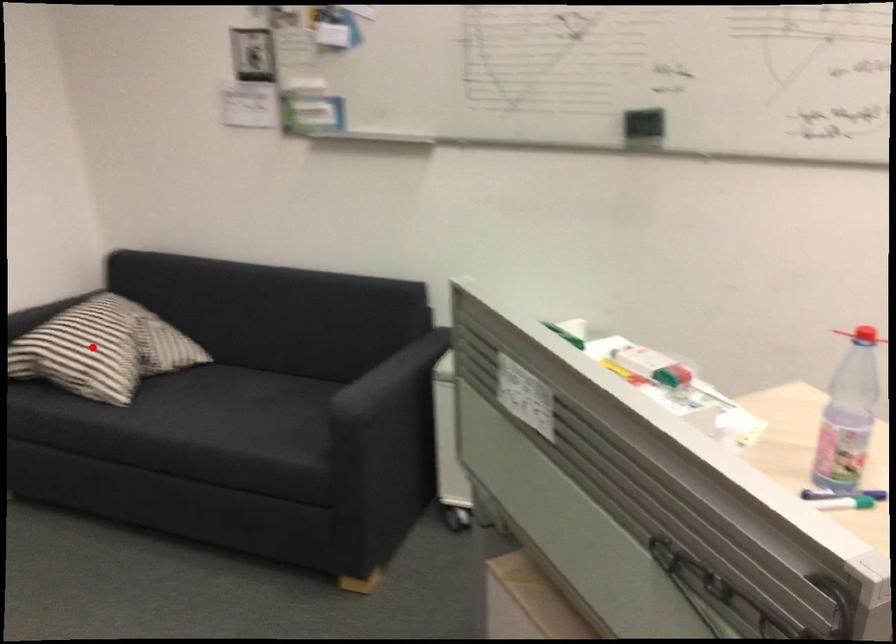
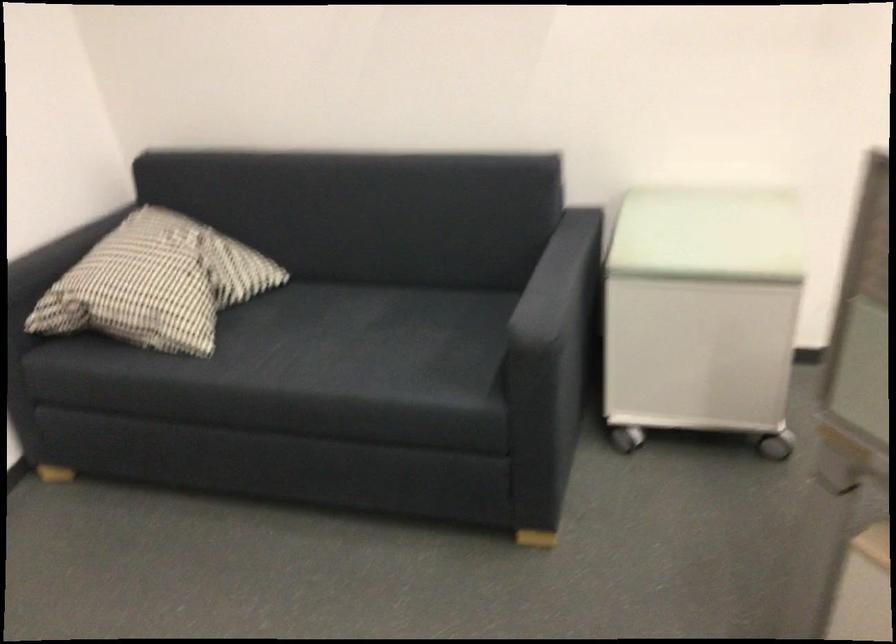
Question: I am providing you with two images of the same scene from different viewpoints. A red point is shown in image1. For the corresponding object point in image2, is it positioned nearer or farther from the camera?

Choices:
 (A) Nearer
 (B) Farther

Answer: (A)